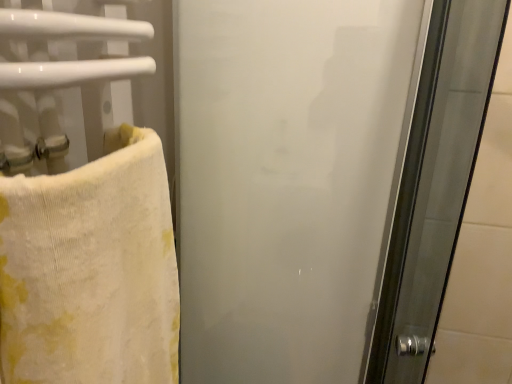
Describe the element at coordinates (289, 180) in the screenshot. This screenshot has height=384, width=512. I see `frosted glass screen door at center` at that location.

Find the location of `frosted glass screen door at center`. frosted glass screen door at center is located at coordinates (289, 180).

The image size is (512, 384). Describe the element at coordinates (91, 270) in the screenshot. I see `yellow cotton towel at left` at that location.

Where is `yellow cotton towel at left`? Image resolution: width=512 pixels, height=384 pixels. yellow cotton towel at left is located at coordinates (91, 270).

Measure the distance between point (106, 193) and camera.

17.60 inches.

At what (x,y) coordinates should I click in order to perform the action: click on frosted glass screen door at center. Please return your answer as a coordinate pair (x, y). Looking at the image, I should click on (289, 180).

From the picture: Does frosted glass screen door at center appear on the left side of yellow cotton towel at left?

Incorrect, frosted glass screen door at center is not on the left side of yellow cotton towel at left.

Considering the positions of objects frosted glass screen door at center and yellow cotton towel at left in the image provided, who is behind, frosted glass screen door at center or yellow cotton towel at left?

frosted glass screen door at center is further away from the camera.

From the picture: Which is nearer, (258, 331) or (48, 250)?

Point (258, 331).

From the image's perspective, would you say frosted glass screen door at center is shown under yellow cotton towel at left?

Actually, frosted glass screen door at center appears above yellow cotton towel at left in the image.

From a real-world perspective, which is physically below, frosted glass screen door at center or yellow cotton towel at left?

frosted glass screen door at center is physically lower.

Between frosted glass screen door at center and yellow cotton towel at left, which one has larger width?

With larger width is frosted glass screen door at center.

Looking at this image, from their relative heights in the image, would you say frosted glass screen door at center is taller or shorter than yellow cotton towel at left?

Considering their sizes, frosted glass screen door at center has more height than yellow cotton towel at left.

Who is smaller, frosted glass screen door at center or yellow cotton towel at left?

yellow cotton towel at left.

Is frosted glass screen door at center surrounding yellow cotton towel at left?

No, yellow cotton towel at left is not inside frosted glass screen door at center.

Would you say frosted glass screen door at center is a long distance from yellow cotton towel at left?

Actually, frosted glass screen door at center and yellow cotton towel at left are a little close together.

Could you tell me if frosted glass screen door at center is facing yellow cotton towel at left?

Yes, frosted glass screen door at center is turned towards yellow cotton towel at left.

You are a GUI agent. You are given a task and a screenshot of the screen. Output one action in this format:
    pyautogui.click(x=<x>, y=<y>)
    Task: Click on the screen door that appears below the yellow cotton towel at left (from a real-world perspective)
    The width and height of the screenshot is (512, 384).
    Given the screenshot: What is the action you would take?
    289,180

Based on their positions, is yellow cotton towel at left located to the left or right of frosted glass screen door at center?

yellow cotton towel at left is to the left of frosted glass screen door at center.

Does yellow cotton towel at left come behind frosted glass screen door at center?

That is False.

Is point (54, 364) positioned after point (312, 366)?

No, (54, 364) is closer to viewer.

From the image's perspective, which one is positioned lower, yellow cotton towel at left or frosted glass screen door at center?

yellow cotton towel at left is shown below in the image.

From a real-world perspective, which is physically below, yellow cotton towel at left or frosted glass screen door at center?

frosted glass screen door at center.

Can you confirm if yellow cotton towel at left is thinner than frosted glass screen door at center?

Yes, yellow cotton towel at left is thinner than frosted glass screen door at center.

Considering the sizes of objects yellow cotton towel at left and frosted glass screen door at center in the image provided, who is shorter, yellow cotton towel at left or frosted glass screen door at center?

yellow cotton towel at left.

Based on their sizes in the image, would you say yellow cotton towel at left is bigger or smaller than frosted glass screen door at center?

In the image, yellow cotton towel at left appears to be smaller than frosted glass screen door at center.

Is frosted glass screen door at center inside yellow cotton towel at left?

Definitely not — frosted glass screen door at center is not inside yellow cotton towel at left.

Is yellow cotton towel at left placed right next to frosted glass screen door at center?

yellow cotton towel at left and frosted glass screen door at center are clearly separated.

Is yellow cotton towel at left oriented away from frosted glass screen door at center?

No, frosted glass screen door at center is not at the back of yellow cotton towel at left.

How different are the orientations of yellow cotton towel at left and frosted glass screen door at center in degrees?

The angular difference between yellow cotton towel at left and frosted glass screen door at center is 90 degrees.

Locate an element on the screen. This screenshot has width=512, height=384. towel that is on the left side of frosted glass screen door at center is located at coordinates pos(91,270).

Identify the location of screen door on the right of the yellow cotton towel at left. (289, 180).

Identify the location of screen door lying above the yellow cotton towel at left (from the image's perspective). The width and height of the screenshot is (512, 384). (289, 180).